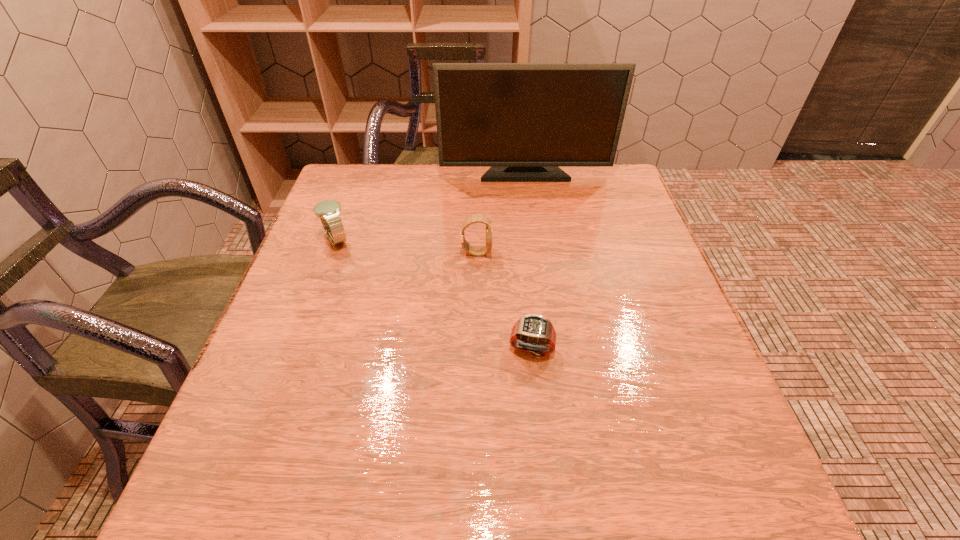
The image size is (960, 540). In order to click on object that is the nearest to the leftmost object in this screenshot , I will do `click(479, 218)`.

Image resolution: width=960 pixels, height=540 pixels. Find the location of `the second closest watch to the monitor`. the second closest watch to the monitor is located at coordinates (328, 211).

Where is `watch object that ranks as the closest to the rightmost watch`? This screenshot has height=540, width=960. watch object that ranks as the closest to the rightmost watch is located at coordinates (479, 218).

Locate an element on the screen. vacant area that satisfies the following two spatial constraints: 1. on the screen side of the farthest object; 2. on the face of the second watch from right to left is located at coordinates (536, 253).

The width and height of the screenshot is (960, 540). I want to click on free space in the image that satisfies the following two spatial constraints: 1. on the face of the second watch from right to left; 2. on the right side of the shortest object, so click(475, 347).